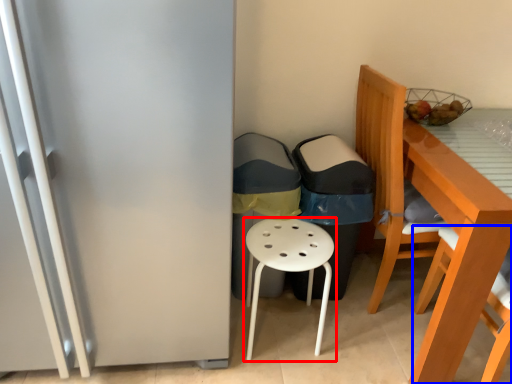
Question: Which of the following is the closest to the observer, stool (highlighted by a red box) or chair (highlighted by a blue box)?

Choices:
 (A) stool
 (B) chair

Answer: (B)